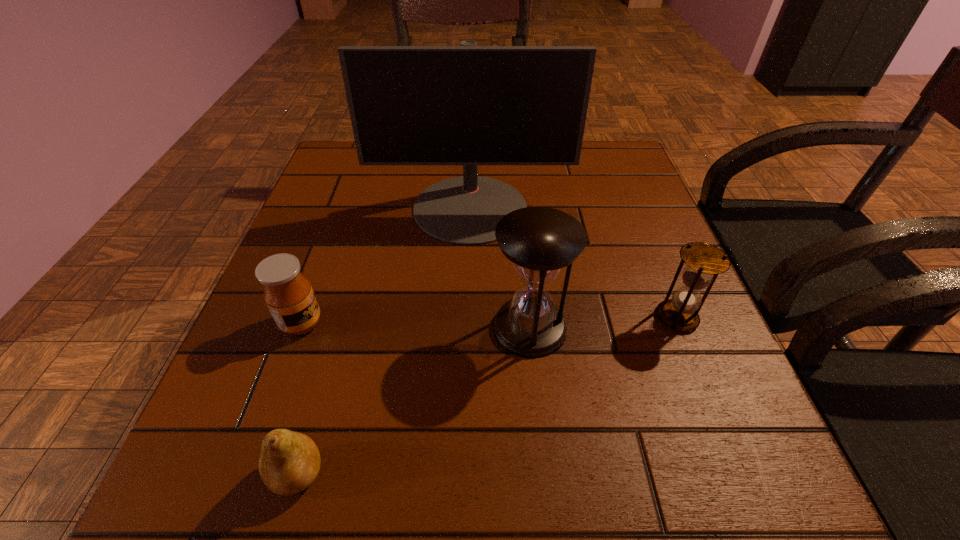
Locate an element on the screen. The image size is (960, 540). object at the near left corner is located at coordinates (290, 461).

Identify the location of vacant space at the near edge of the desktop. (572, 477).

Find the location of a particular element. vacant space at the left edge of the desktop is located at coordinates (363, 241).

The image size is (960, 540). What are the coordinates of `vacant region at the right edge` in the screenshot? It's located at (756, 433).

The image size is (960, 540). I want to click on free space at the far left corner of the desktop, so click(x=383, y=188).

Identify the location of vacant space at the near left corner of the desktop. This screenshot has width=960, height=540. (261, 518).

Where is `free space at the far right corner of the desktop`? free space at the far right corner of the desktop is located at coordinates (604, 183).

Locate an element on the screen. This screenshot has height=540, width=960. vacant area at the near right corner of the desktop is located at coordinates (737, 482).

Find the location of `empty space between the tallest object and the honey`. empty space between the tallest object and the honey is located at coordinates (386, 266).

Locate an element on the screen. This screenshot has height=540, width=960. blank region between the taller hourglass and the computer monitor is located at coordinates (500, 268).